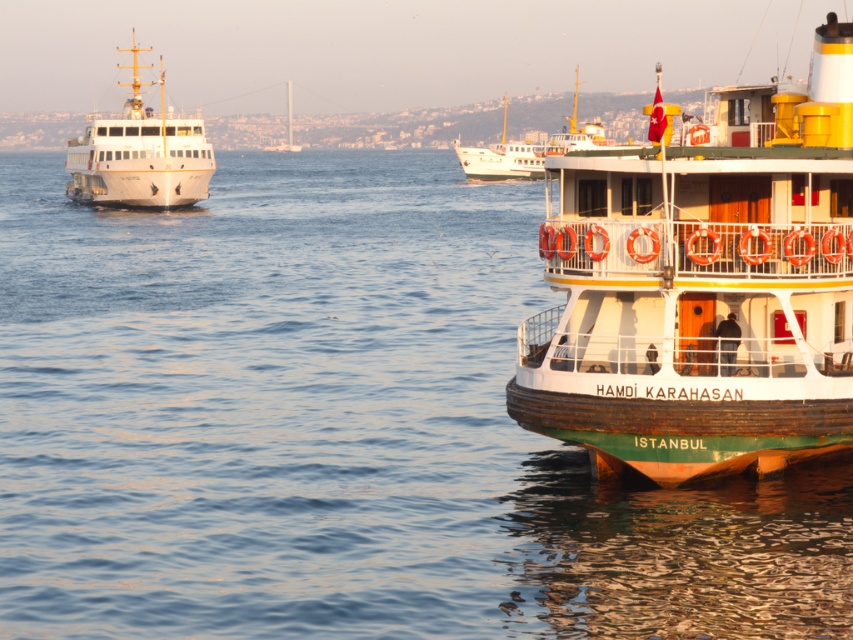
You are standing on the deck of the ferry named Hamdi Karahasn with a telescope that has a maximum viewing distance of 25 meters. You see the wooden ship at right. Can you see it clearly through the telescope?

The wooden ship at right is 24.56 meters away from the viewer, so yes, you can see it clearly through the telescope since it is within the telescope maximum viewing distance of 25 meters.

You are a photographer planning to capture a wide shot of the maritime scene. You need to ensure that both the white glossy ferry at upper left and the white matte boat at center are fully visible in your frame. Given that your camera has a fixed focal length that can only accommodate objects up to the width of the wider vessel, which vessel determines the minimum required width of your camera frame?

The white glossy ferry at upper left determines the minimum required width of your camera frame because it is wider than the white matte boat at center.

You are standing on the wooden dock at lower right. You see the point at coordinates [703,288]. Which object is the point on?

The point at coordinates [703,288] is on the wooden ship at right.